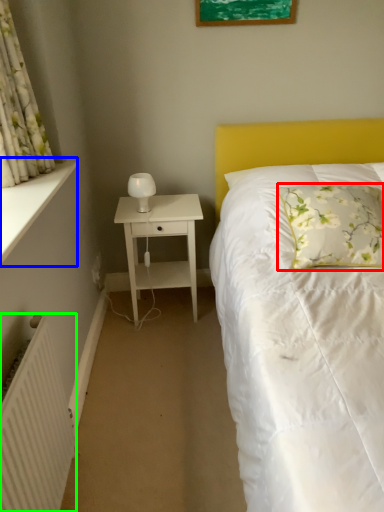
Question: Based on their relative distances, which object is farther from pillow (highlighted by a red box)? Choose from window sill (highlighted by a blue box) and radiator (highlighted by a green box).

Choices:
 (A) window sill
 (B) radiator

Answer: (B)